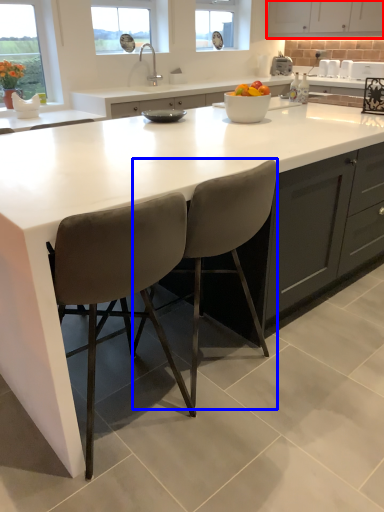
Question: Which point is further to the camera, cabinetry (highlighted by a red box) or chair (highlighted by a blue box)?

Choices:
 (A) cabinetry
 (B) chair

Answer: (A)